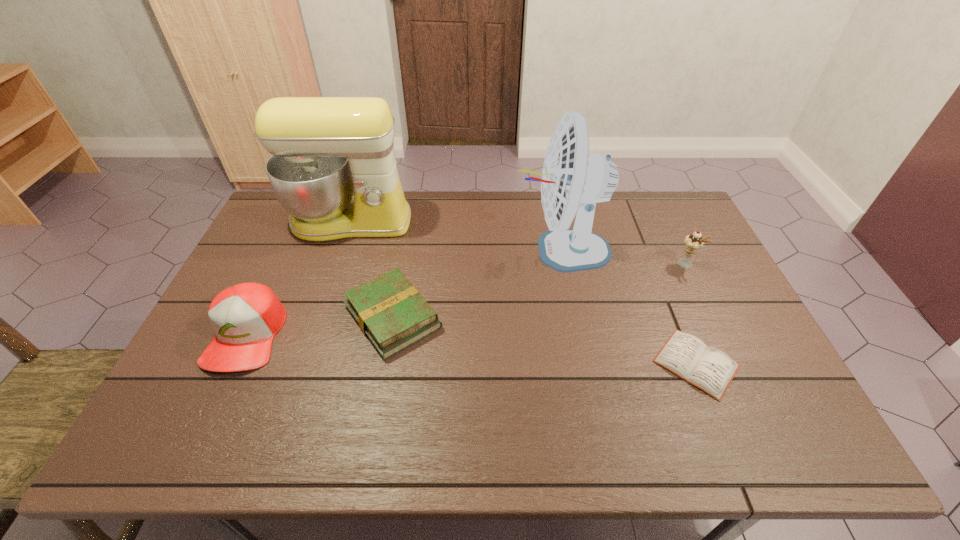
This screenshot has width=960, height=540. I want to click on vacant position located 0.260m on the front of the third tallest object, so click(722, 340).

I want to click on free space located on the front-facing side of the baseball cap, so click(x=202, y=430).

The image size is (960, 540). I want to click on vacant point located 0.320m on the left of the book, so click(x=228, y=317).

Where is `free space located on the left of the diary`? The height and width of the screenshot is (540, 960). free space located on the left of the diary is located at coordinates (531, 363).

Where is `fan that is at the far edge`? Image resolution: width=960 pixels, height=540 pixels. fan that is at the far edge is located at coordinates (573, 180).

Identify the location of mixer situated at the far edge. (324, 149).

The width and height of the screenshot is (960, 540). Find the location of `mixer that is positioned at the left edge`. mixer that is positioned at the left edge is located at coordinates (324, 149).

This screenshot has width=960, height=540. Identify the location of baseball cap that is at the left edge. (245, 317).

The width and height of the screenshot is (960, 540). I want to click on icecream at the right edge, so click(x=694, y=242).

Where is `diary situated at the right edge`? This screenshot has height=540, width=960. diary situated at the right edge is located at coordinates (709, 369).